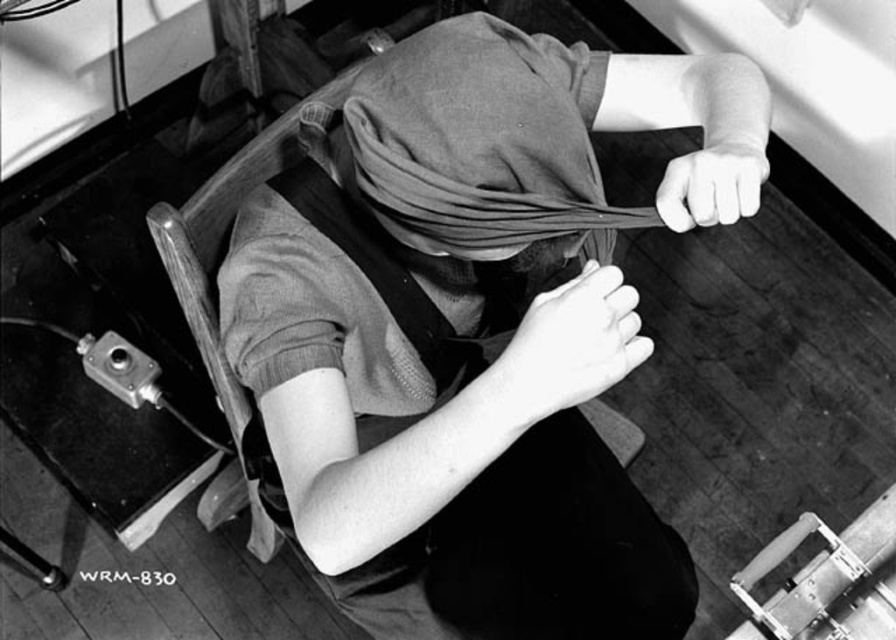
Question: Which object is closer to the camera taking this photo?

Choices:
 (A) matte fabric head covering at center
 (B) white matte hand at upper right

Answer: (A)

Question: Is matte fabric head covering at center to the left of black leather strap at center from the viewer's perspective?

Choices:
 (A) yes
 (B) no

Answer: (B)

Question: Can you confirm if smooth skin hand at center is positioned above white matte hand at upper right?

Choices:
 (A) no
 (B) yes

Answer: (A)

Question: Is matte fabric head covering at center thinner than black leather strap at center?

Choices:
 (A) yes
 (B) no

Answer: (B)

Question: Which object appears farthest from the camera in this image?

Choices:
 (A) matte fabric head covering at center
 (B) smooth skin hand at center
 (C) black leather strap at center

Answer: (C)

Question: Which of the following is the farthest from the observer?

Choices:
 (A) white matte hand at upper right
 (B) smooth skin hand at center
 (C) black leather strap at center

Answer: (C)